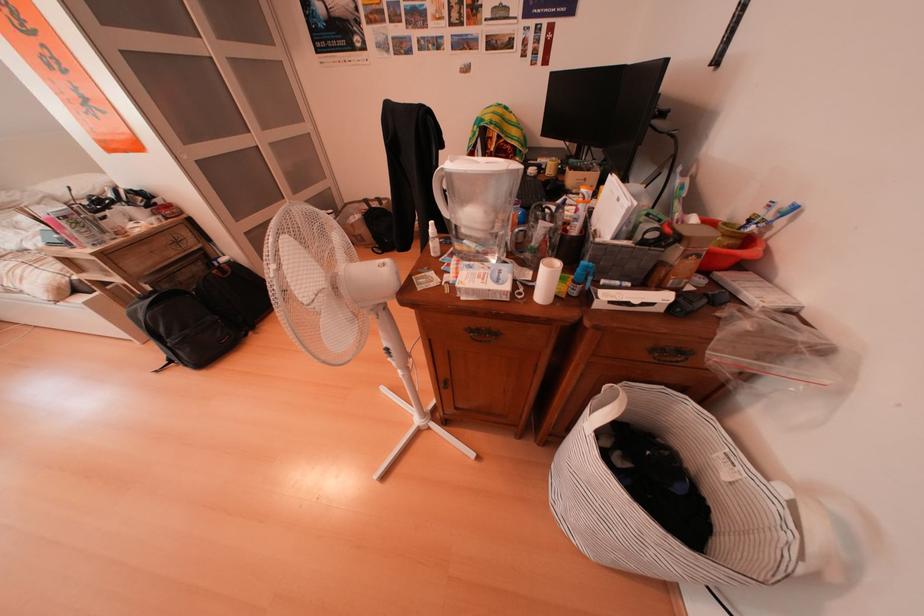
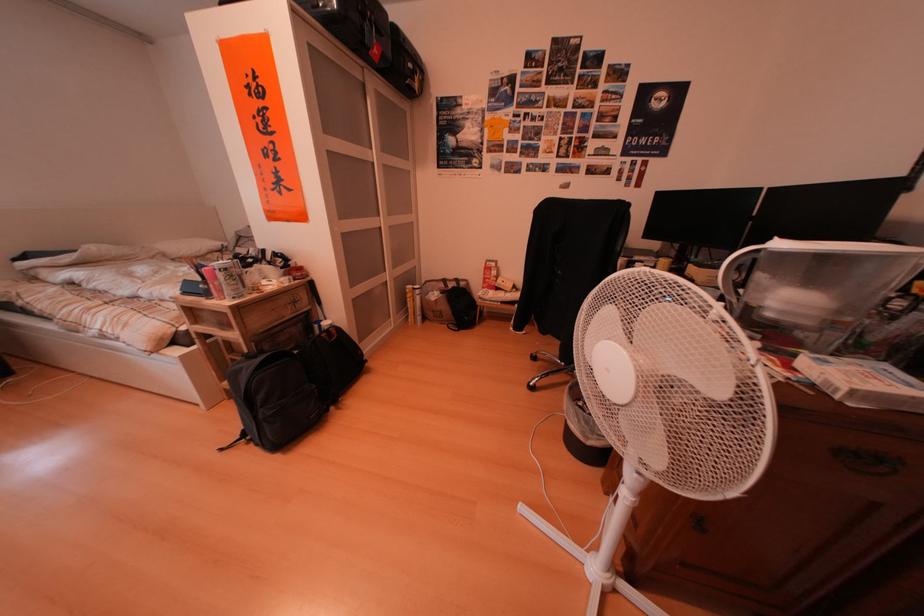
Question: Based on the continuous images, in which direction is the camera rotating? Reply with the corresponding letter.

Choices:
 (A) Left
 (B) Right
 (C) Up
 (D) Down

Answer: (C)